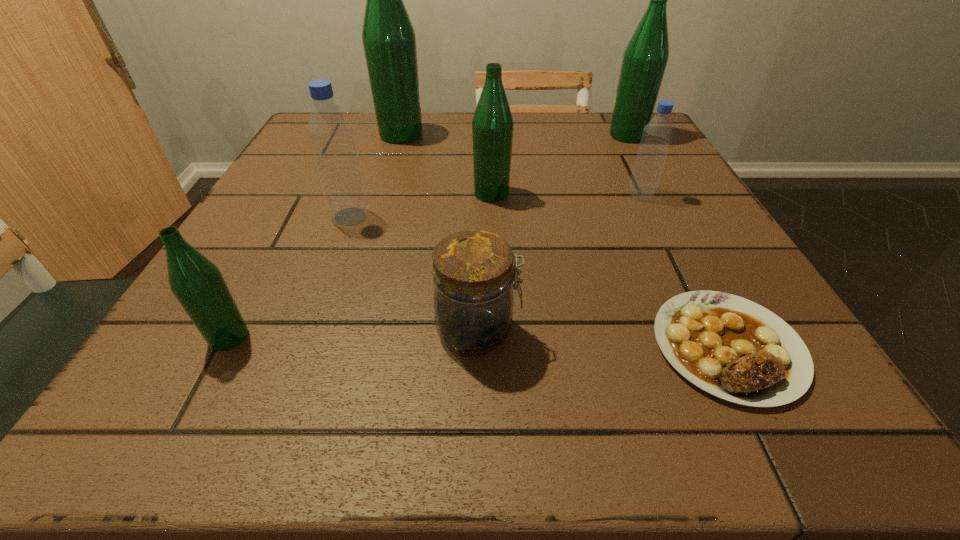
The image size is (960, 540). In order to click on the biggest green bottle in this screenshot , I will do `click(389, 41)`.

Identify the location of the tallest object. The image size is (960, 540). (389, 41).

You are a GUI agent. You are given a task and a screenshot of the screen. Output one action in this format:
    pyautogui.click(x=<x>, y=<y>)
    Task: Click on the seventh shortest object
    Image resolution: width=960 pixels, height=540 pixels.
    Given the screenshot: What is the action you would take?
    pyautogui.click(x=645, y=58)

Where is `the rightmost green bottle`? This screenshot has width=960, height=540. the rightmost green bottle is located at coordinates (645, 58).

I want to click on the third green bottle from left to right, so click(492, 124).

Image resolution: width=960 pixels, height=540 pixels. Find the location of `the second nearest green bottle`. the second nearest green bottle is located at coordinates (492, 124).

Where is `the left blue bottle`? Image resolution: width=960 pixels, height=540 pixels. the left blue bottle is located at coordinates (330, 131).

The height and width of the screenshot is (540, 960). What are the coordinates of `the fifth farthest bottle` in the screenshot? It's located at (330, 131).

Identify the location of the right blue bottle. (657, 134).

Find the location of a particular element. The height and width of the screenshot is (540, 960). the farther blue bottle is located at coordinates (657, 134).